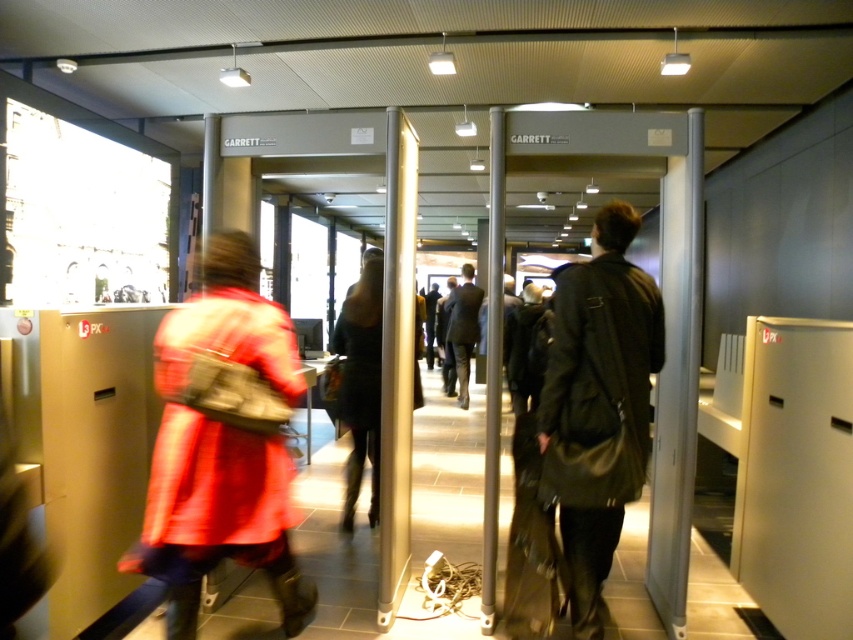
You are a traveler at the airport security checkpoint. You need to choose between two points to stand while waiting for your turn. One is at point (227,426) and the other is at point (463,404). Which point is closer to the entrance of the metal detector?

Point (227,426) is in front of point (463,404), so it is closer to the entrance of the metal detector.

You are a security guard at the checkpoint and need to check the items of the person wearing the matte red coat at center and the dark gray suit at center. Which person should you check first based on their position?

The matte red coat at center is located below dark gray suit at center, so you should check the person wearing the dark gray suit at center first since they are positioned higher and likely closer to the security area.

You are a security officer standing at the checkpoint. You need to inspect the matte red coat at center. Can you reach it without moving from your current position if your arm can extend 2 meters?

The matte red coat at center is 1.99 meters away from the viewer. Since your arm can extend 2 meters, you can reach it without moving from your current position.